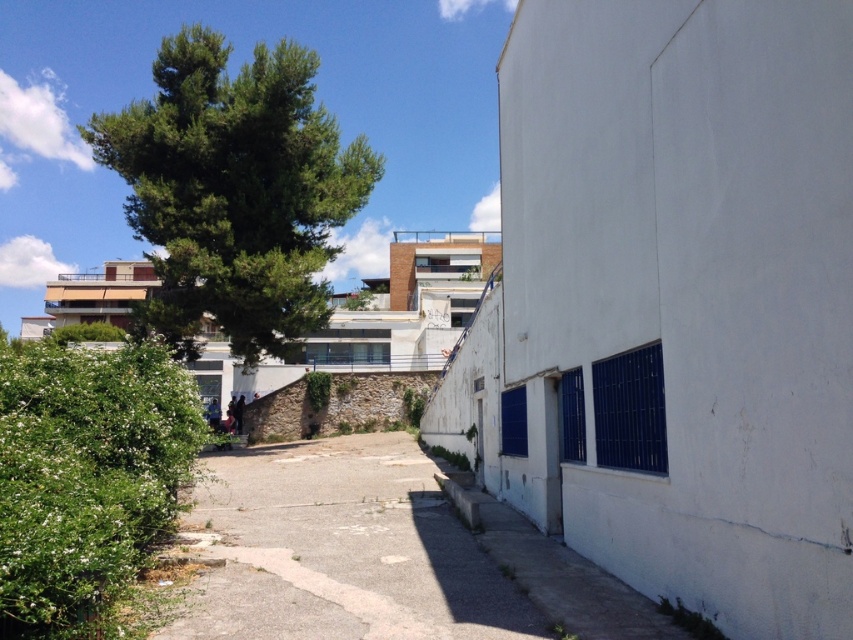
Is green leafy tree at upper left to the right of gray concrete path at lower left from the viewer's perspective?

No, green leafy tree at upper left is not to the right of gray concrete path at lower left.

Who is more forward, (294, 289) or (210, 618)?

Point (210, 618) is in front.

Who is more forward, (248, 348) or (245, 452)?

Point (245, 452)

You are a GUI agent. You are given a task and a screenshot of the screen. Output one action in this format:
    pyautogui.click(x=<x>, y=<y>)
    Task: Click on the green leafy tree at upper left
    This screenshot has height=640, width=853.
    Given the screenshot: What is the action you would take?
    pyautogui.click(x=234, y=192)

Is green leafy tree at upper left shorter than green leafy bush at left?

No, green leafy tree at upper left is not shorter than green leafy bush at left.

Can you confirm if green leafy tree at upper left is wider than green leafy bush at left?

Correct, the width of green leafy tree at upper left exceeds that of green leafy bush at left.

Measure the distance between green leafy tree at upper left and camera.

They are 86.92 feet apart.

You are a GUI agent. You are given a task and a screenshot of the screen. Output one action in this format:
    pyautogui.click(x=<x>, y=<y>)
    Task: Click on the green leafy tree at upper left
    
    Given the screenshot: What is the action you would take?
    pyautogui.click(x=234, y=192)

Is point (316, 516) positioned before point (65, 548)?

No, it is behind (65, 548).

Does gray concrete path at lower left have a larger size compared to green leafy bush at left?

Actually, gray concrete path at lower left might be smaller than green leafy bush at left.

This screenshot has width=853, height=640. What do you see at coordinates (341, 550) in the screenshot?
I see `gray concrete path at lower left` at bounding box center [341, 550].

At what (x,y) coordinates should I click in order to perform the action: click on gray concrete path at lower left. Please return your answer as a coordinate pair (x, y). The image size is (853, 640). Looking at the image, I should click on (341, 550).